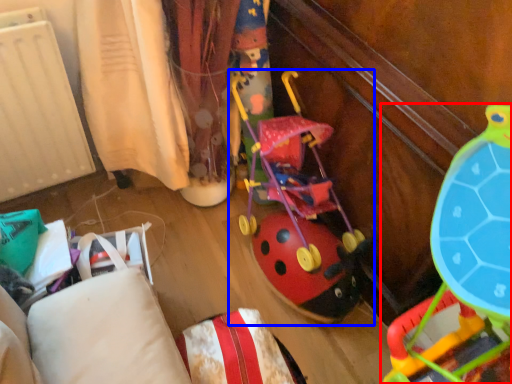
Question: Which point is closer to the camera, toy (highlighted by a red box) or toy (highlighted by a blue box)?

Choices:
 (A) toy
 (B) toy

Answer: (A)